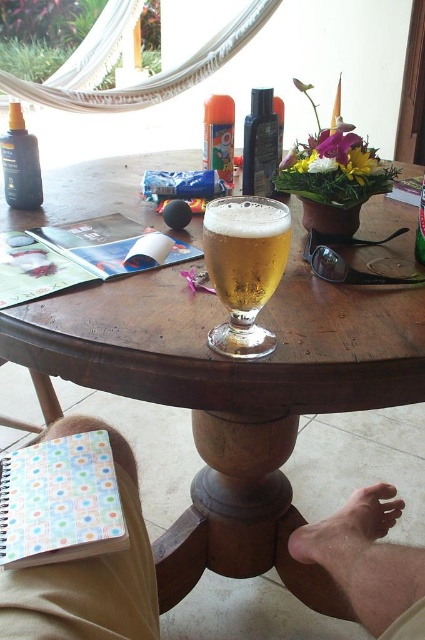
You are a barista at the cafe and want to place a new menu brochure on the table. The brochure is 10 cm wide. You need to choose between placing it next to the skinny tan leg at lower center or the matte black lotion at upper left. Which location has enough space for the brochure?

The matte black lotion at upper left has less width than the skinny tan leg at lower center, so placing the brochure next to the matte black lotion at upper left may not provide enough space. The brochure should be placed next to the skinny tan leg at lower center where there is more space.

You are a photographer trying to capture the black plastic bottle at center and the pale skin foot at lower center in a single shot. Which object will appear larger in the photo?

The pale skin foot at lower center will appear larger in the photo because it is closer to the viewer than the black plastic bottle at center.

You are a barista at the cafe and need to place a new menu on the table. The menu is 12 inches tall. The table has limited space between the pale skin foot at lower center and the black plastic bottle at center. Can the menu fit vertically between them?

The pale skin foot at lower center is below the black plastic bottle at center, so the vertical space between them is sufficient to fit the 12 inch tall menu.